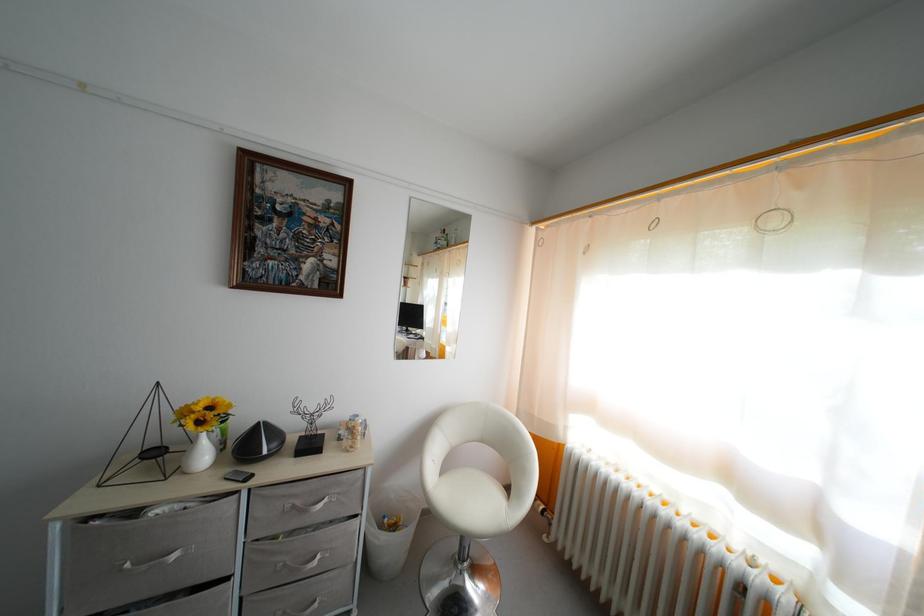
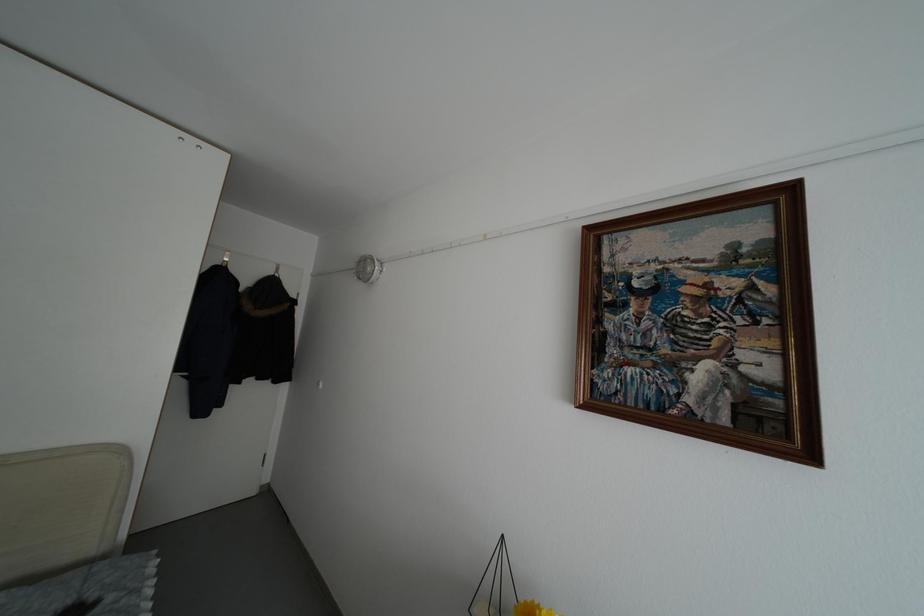
The images are taken continuously from a first-person perspective. In which direction is your viewpoint rotating?

The rotation direction of the camera is left-up.